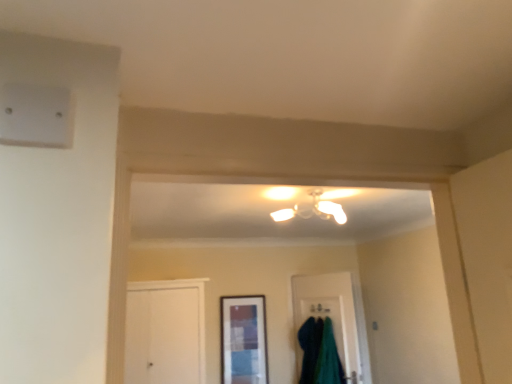
Question: From the image's perspective, is matte white chandelier at center above or below teal fuzzy robe at lower center?

Choices:
 (A) above
 (B) below

Answer: (A)

Question: Looking at the image, does matte white chandelier at center seem bigger or smaller compared to teal fuzzy robe at lower center?

Choices:
 (A) big
 (B) small

Answer: (B)

Question: Which is nearer to the matte white chandelier at center?

Choices:
 (A) green fabric at lower center
 (B) teal fuzzy robe at lower center
 (C) matte glass window at center

Answer: (A)

Question: Which object is the farthest from the teal fuzzy robe at lower center?

Choices:
 (A) matte glass window at center
 (B) matte white chandelier at center
 (C) green fabric at lower center

Answer: (B)